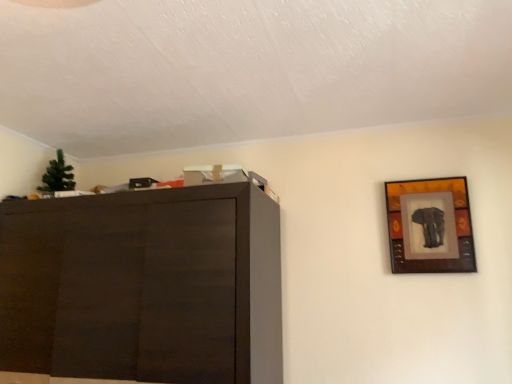
Image resolution: width=512 pixels, height=384 pixels. Find the location of `matte black picture frame at upper right`. matte black picture frame at upper right is located at coordinates [x=430, y=226].

Describe the element at coordinates (430, 226) in the screenshot. I see `matte black picture frame at upper right` at that location.

Image resolution: width=512 pixels, height=384 pixels. I want to click on matte black picture frame at upper right, so [430, 226].